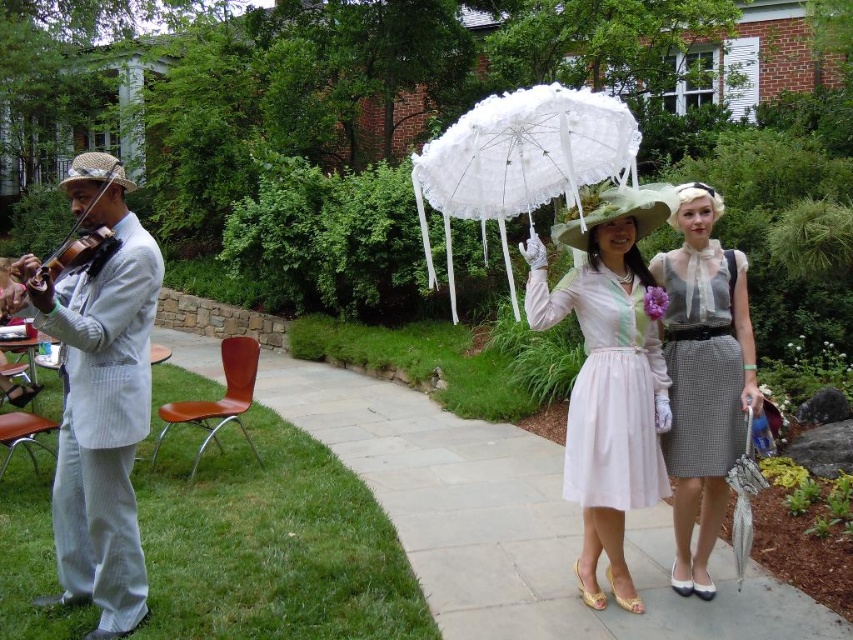
Is checkered fabric dress at center below white sheer blouse at center?

Correct, checkered fabric dress at center is located below white sheer blouse at center.

Between point (686, 278) and point (723, 358), which one is positioned behind?

Point (686, 278)

Locate an element on the screen. checkered fabric dress at center is located at coordinates (703, 378).

Can you confirm if matte pink dress at center is thinner than white lace umbrella at center?

No, matte pink dress at center is not thinner than white lace umbrella at center.

Who is more distant from viewer, (751, 387) or (577, 100)?

Positioned behind is point (751, 387).

Find the location of `matte pink dress at center`. matte pink dress at center is located at coordinates (618, 364).

Between point (132, 554) and point (569, 92), which one is positioned in front?

Positioned in front is point (569, 92).

Is point (96, 291) positioned after point (508, 176)?

No, it is not.

This screenshot has width=853, height=640. Describe the element at coordinates (97, 396) in the screenshot. I see `light gray striped suit at left` at that location.

Where is `light gray striped suit at left`? light gray striped suit at left is located at coordinates (97, 396).